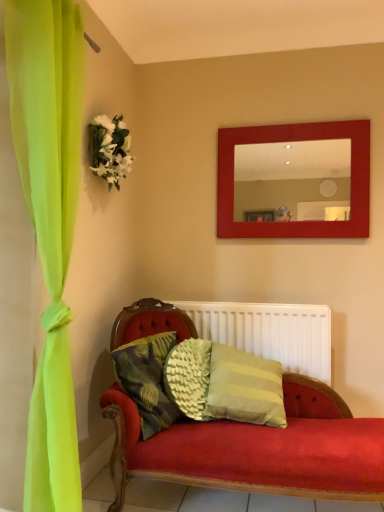
Find the location of a particular element. textured green pillow at center is located at coordinates (147, 380).

Is matte red mirror at upper center facing away from white silk flowers at upper left?

matte red mirror at upper center is not turned away from white silk flowers at upper left.

Can you see matte red mirror at upper center touching white silk flowers at upper left?

No, matte red mirror at upper center is not in contact with white silk flowers at upper left.

Based on the photo, from a real-world perspective, which is physically above, matte red mirror at upper center or white silk flowers at upper left?

In real-world perspective, white silk flowers at upper left is above.

In terms of height, does matte red mirror at upper center look taller or shorter compared to white silk flowers at upper left?

Considering their sizes, matte red mirror at upper center has more height than white silk flowers at upper left.

Between point (162, 345) and point (112, 145), which one is positioned behind?

Positioned behind is point (112, 145).

Would you say textured green pillow at center is a long distance from white silk flowers at upper left?

Yes, textured green pillow at center is far from white silk flowers at upper left.

In the scene shown: From the image's perspective, is textured green pillow at center located above white silk flowers at upper left?

No.

How many degrees apart are the facing directions of textured green pillow at center and white silk flowers at upper left?

19.4 degrees.

Is point (281, 163) positioned before point (282, 333)?

No, it is behind (282, 333).

Does matte red mirror at upper center touch white matte radiator at center?

There is a gap between matte red mirror at upper center and white matte radiator at center.

From a real-world perspective, between matte red mirror at upper center and white matte radiator at center, who is vertically lower?

white matte radiator at center is physically lower.

Looking at this image, between textured green pillow at center and white matte radiator at center, which one has less height?

Standing shorter between the two is textured green pillow at center.

Looking at this image, is white matte radiator at center a part of textured green pillow at center?

Actually, white matte radiator at center is outside textured green pillow at center.

In the scene shown: Is textured green pillow at center placed right next to white matte radiator at center?

textured green pillow at center and white matte radiator at center are clearly separated.

You are a GUI agent. You are given a task and a screenshot of the screen. Output one action in this format:
    pyautogui.click(x=<x>, y=<y>)
    Task: Click on the pillow that is under the white silk flowers at upper left (from a real-world perspective)
    
    Given the screenshot: What is the action you would take?
    pyautogui.click(x=147, y=380)

Can you tell me how much white silk flowers at upper left and textured green pillow at center differ in facing direction?

The facing directions of white silk flowers at upper left and textured green pillow at center are 19.4 degrees apart.

Between white silk flowers at upper left and textured green pillow at center, which one has smaller width?

white silk flowers at upper left is thinner.

From the picture: Is white silk flowers at upper left not within textured green pillow at center?

Absolutely, white silk flowers at upper left is external to textured green pillow at center.

Can you confirm if matte red mirror at upper center is shorter than textured green pillow at center?

Incorrect, the height of matte red mirror at upper center does not fall short of that of textured green pillow at center.

Is matte red mirror at upper center positioned beyond the bounds of textured green pillow at center?

matte red mirror at upper center lies outside textured green pillow at center's area.

At what (x,y) coordinates should I click in order to perform the action: click on mirror above the textured green pillow at center (from the image's perspective). Please return your answer as a coordinate pair (x, y). Looking at the image, I should click on (293, 180).

Is point (338, 166) positioned in front of point (134, 367)?

No, (338, 166) is further to viewer.

Can you confirm if white matte radiator at center is thinner than textured green pillow at center?

Correct, the width of white matte radiator at center is less than that of textured green pillow at center.

Is white matte radiator at center aimed at textured green pillow at center?

Yes, white matte radiator at center is aimed at textured green pillow at center.

Are white matte radiator at center and textured green pillow at center far apart?

Actually, white matte radiator at center and textured green pillow at center are a little close together.

At what (x,y) coordinates should I click in order to perform the action: click on radiator that appears above the textured green pillow at center (from a real-world perspective). Please return your answer as a coordinate pair (x, y). This screenshot has width=384, height=512. Looking at the image, I should click on (269, 332).

I want to click on floral arrangement in front of the matte red mirror at upper center, so click(x=109, y=149).

Find the location of a particular element. pillow that is on the right side of white silk flowers at upper left is located at coordinates (147, 380).

From the image, which object appears to be nearer to matte red mirror at upper center, white silk flowers at upper left or textured green pillow at center?

white silk flowers at upper left lies closer to matte red mirror at upper center than the other object.

Estimate the real-world distances between objects in this image. Which object is further from white matte radiator at center, white silk flowers at upper left or matte red mirror at upper center?

white silk flowers at upper left lies further to white matte radiator at center than the other object.

From the image, which object appears to be nearer to white matte radiator at center, textured green pillow at center or matte red mirror at upper center?

Among the two, textured green pillow at center is located nearer to white matte radiator at center.

When comparing their distances from matte red mirror at upper center, does white matte radiator at center or textured green pillow at center seem further?

textured green pillow at center is further to matte red mirror at upper center.

Looking at the image, which one is located closer to textured green pillow at center, white matte radiator at center or white silk flowers at upper left?

white matte radiator at center is positioned closer to the anchor textured green pillow at center.

When comparing their distances from textured green pillow at center, does matte red mirror at upper center or white silk flowers at upper left seem further?

Among the two, matte red mirror at upper center is located further to textured green pillow at center.

Estimate the real-world distances between objects in this image. Which object is closer to white silk flowers at upper left, textured green pillow at center or white matte radiator at center?

The object closer to white silk flowers at upper left is textured green pillow at center.

Consider the image. Considering their positions, is textured green pillow at center positioned closer to white silk flowers at upper left than matte red mirror at upper center?

Result: matte red mirror at upper center lies closer to white silk flowers at upper left than the other object.

Identify the location of mirror between white silk flowers at upper left and textured green pillow at center vertically. (293, 180).

Where is `mirror between white silk flowers at upper left and white matte radiator at center from top to bottom`? mirror between white silk flowers at upper left and white matte radiator at center from top to bottom is located at coordinates (293, 180).

In order to click on radiator between white silk flowers at upper left and textured green pillow at center from top to bottom in this screenshot , I will do `click(269, 332)`.

You are a GUI agent. You are given a task and a screenshot of the screen. Output one action in this format:
    pyautogui.click(x=<x>, y=<y>)
    Task: Click on the radiator between matte red mirror at upper center and textured green pillow at center from top to bottom
    
    Given the screenshot: What is the action you would take?
    pyautogui.click(x=269, y=332)